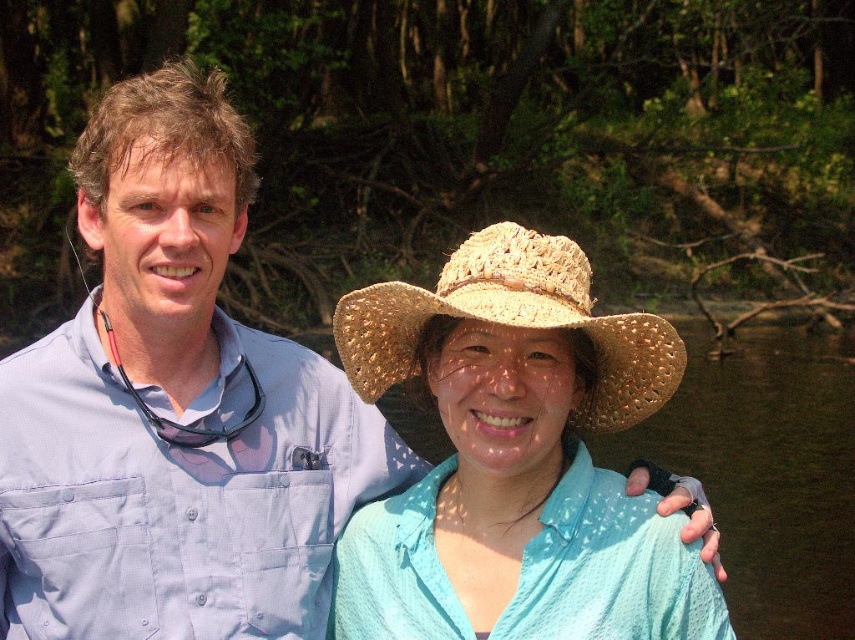
Question: Which of the following is the farthest from the observer?

Choices:
 (A) straw woven hat at center
 (B) woven straw hat at center

Answer: (A)

Question: Does woven straw hat at center come in front of straw woven hat at center?

Choices:
 (A) no
 (B) yes

Answer: (B)

Question: Does woven straw hat at center appear on the left side of straw woven hat at center?

Choices:
 (A) no
 (B) yes

Answer: (A)

Question: Is woven straw hat at center further to camera compared to straw woven hat at center?

Choices:
 (A) yes
 (B) no

Answer: (B)

Question: Which point is farther from the camera taking this photo?

Choices:
 (A) (562, 262)
 (B) (476, 236)

Answer: (B)